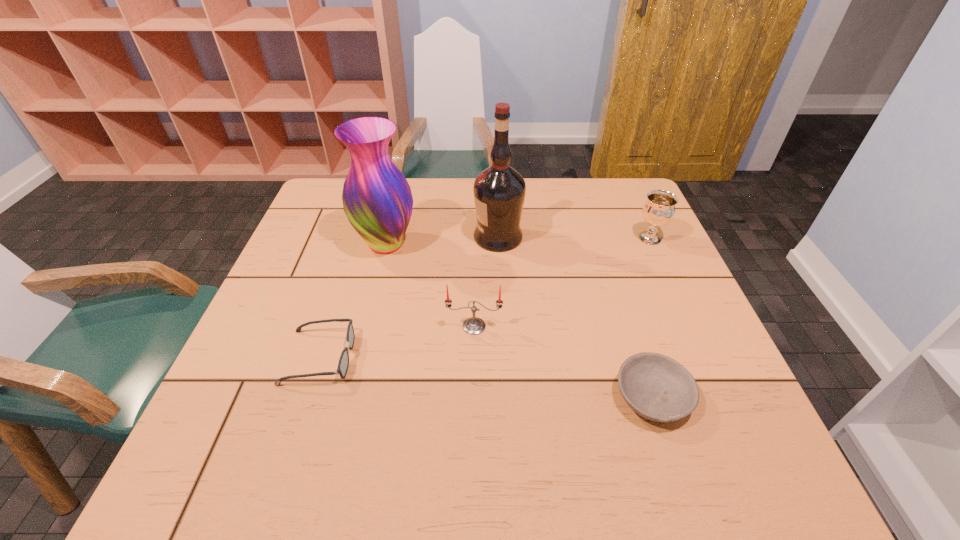
Find the location of a particular element. The height and width of the screenshot is (540, 960). vacant region located on the left of the chalice is located at coordinates (525, 238).

The image size is (960, 540). What are the coordinates of `blank area located 0.200m on the front-facing side of the candle` in the screenshot? It's located at (473, 416).

Where is `vacant position located on the face of the spectacles`? The image size is (960, 540). vacant position located on the face of the spectacles is located at coordinates (381, 357).

Find the location of `vacant space situated 0.240m on the back of the fifth object from left to right`. vacant space situated 0.240m on the back of the fifth object from left to right is located at coordinates (616, 286).

This screenshot has width=960, height=540. I want to click on object at the left edge, so click(x=343, y=364).

Find the location of `chalice at the right edge`. chalice at the right edge is located at coordinates pos(659,209).

The height and width of the screenshot is (540, 960). Identify the location of bowl at the right edge. pyautogui.click(x=657, y=387).

This screenshot has width=960, height=540. In the image, there is a desktop. Find the location of `vacant space at the far edge`. vacant space at the far edge is located at coordinates pos(436,198).

This screenshot has width=960, height=540. I want to click on vacant space at the near edge of the desktop, so click(x=446, y=458).

You are a GUI agent. You are given a task and a screenshot of the screen. Output one action in this format:
    pyautogui.click(x=<x>, y=<y>)
    Task: Click on the free space at the left edge
    
    Given the screenshot: What is the action you would take?
    pyautogui.click(x=285, y=436)